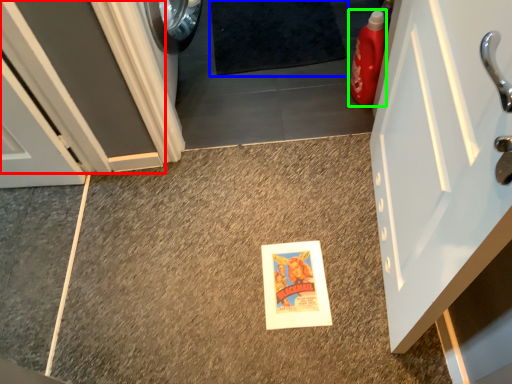
Question: Based on their relative distances, which object is farther from door (highlighted by a red box)? Choose from bath mat (highlighted by a blue box) and cleaning product (highlighted by a green box).

Choices:
 (A) bath mat
 (B) cleaning product

Answer: (B)